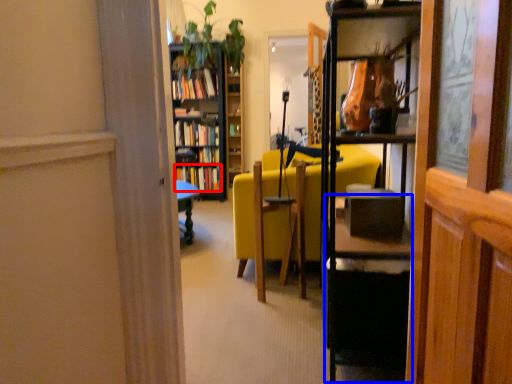
Question: Which point is further to the camera, book (highlighted by a red box) or table (highlighted by a blue box)?

Choices:
 (A) book
 (B) table

Answer: (A)